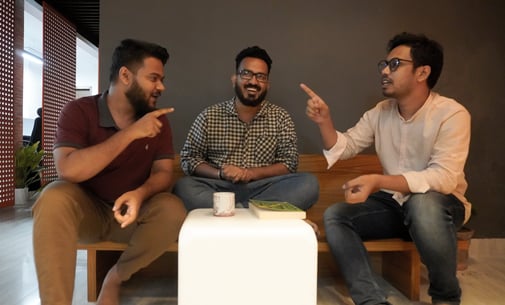
The image size is (505, 305). I want to click on window, so click(30, 90), click(87, 54).